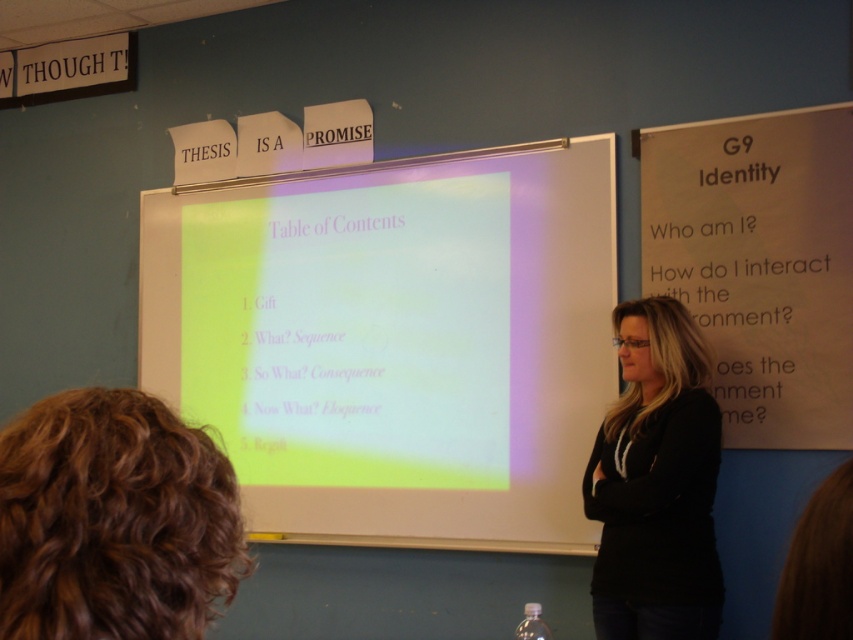
Based on the photo, does white paper at right have a lesser width compared to black cotton shirt at center?

Incorrect, white paper at right's width is not less than black cotton shirt at center's.

Between point (776, 317) and point (666, 554), which one is positioned in front?

Point (666, 554) is more forward.

Identify the location of white paper at right. (759, 264).

Who is more forward, (471, 502) or (779, 189)?

Positioned in front is point (779, 189).

Is matte white projector screen at center behind white paper at right?

Yes, matte white projector screen at center is behind white paper at right.

Is point (355, 355) behind point (788, 292)?

Yes, point (355, 355) is farther from viewer.

Locate an element on the screen. Image resolution: width=853 pixels, height=640 pixels. matte white projector screen at center is located at coordinates (393, 340).

Identify the location of matte white projector screen at center. The width and height of the screenshot is (853, 640). (393, 340).

Is matte white projector screen at center positioned before black cotton shirt at center?

No, matte white projector screen at center is behind black cotton shirt at center.

The height and width of the screenshot is (640, 853). I want to click on matte white projector screen at center, so click(x=393, y=340).